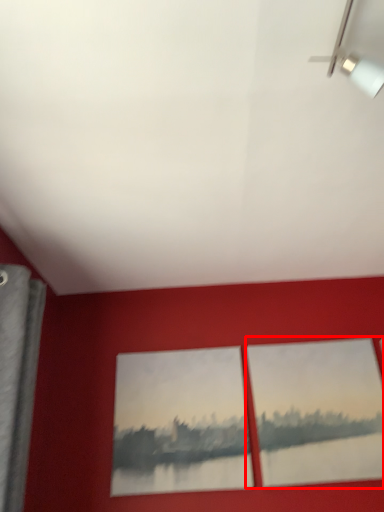
Question: Where is picture frame (annotated by the red box) located in relation to picture frame in the image?

Choices:
 (A) left
 (B) right

Answer: (B)